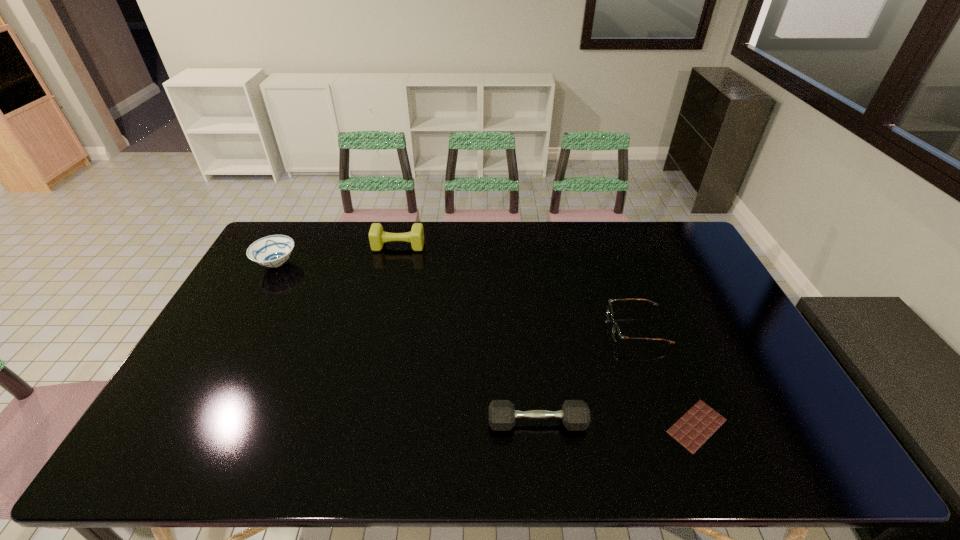
At what (x,y) coordinates should I click in order to perform the action: click on the left dumbbell. Please return your answer as a coordinate pair (x, y). Image resolution: width=960 pixels, height=540 pixels. Looking at the image, I should click on (377, 237).

This screenshot has width=960, height=540. I want to click on the second object from left to right, so click(x=377, y=237).

Locate an element on the screen. This screenshot has width=960, height=540. soup bowl is located at coordinates (272, 251).

Find the location of a particular element. Image resolution: width=960 pixels, height=540 pixels. the right dumbbell is located at coordinates (575, 414).

Locate an element on the screen. the shorter dumbbell is located at coordinates (575, 414).

At what (x,y) coordinates should I click in order to perform the action: click on spectacles. Please return your answer as a coordinate pair (x, y). The height and width of the screenshot is (540, 960). Looking at the image, I should click on (616, 333).

Where is `the fourth tallest object`? the fourth tallest object is located at coordinates (616, 333).

Find the location of a particular element. chocolate bar is located at coordinates (698, 424).

Locate an element on the screen. free space located on the left of the farther dumbbell is located at coordinates (270, 246).

At what (x,y) coordinates should I click in order to perform the action: click on free space located 0.080m on the right of the leftmost object. Please return your answer as a coordinate pair (x, y). The width and height of the screenshot is (960, 540). Looking at the image, I should click on (322, 264).